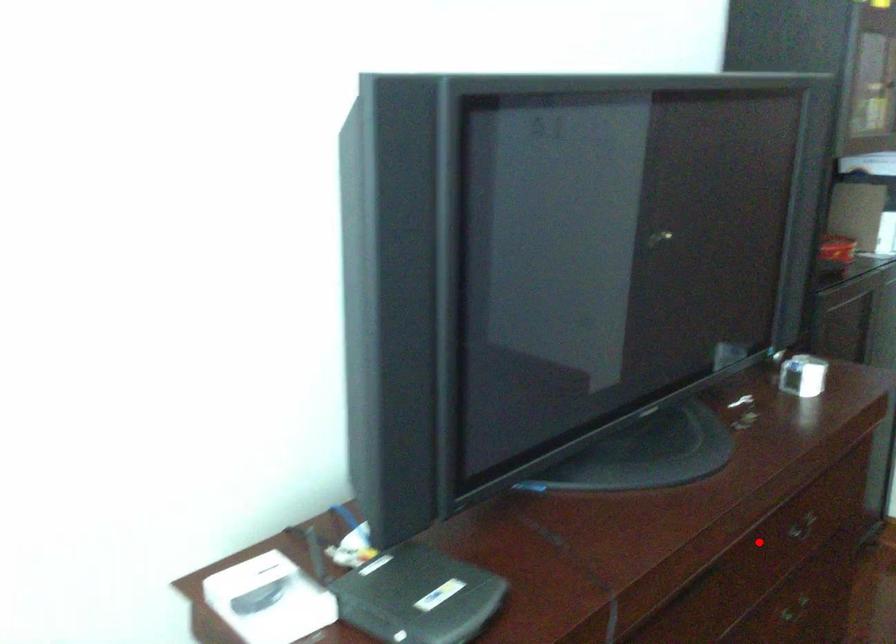
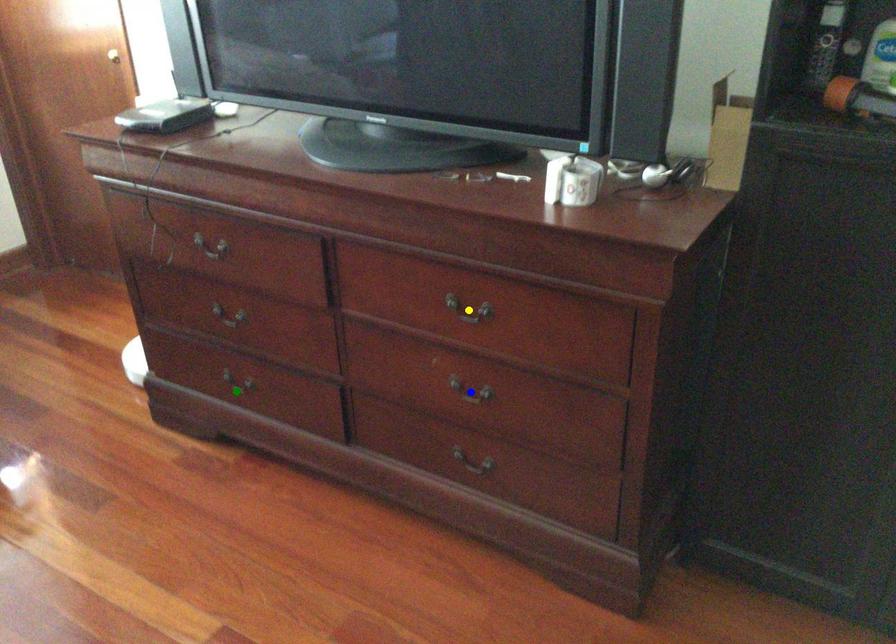
Question: I am providing you with two images of the same scene from different viewpoints. A red point is marked on the first image. You are given multiple points on the second image. Which spot in image 2 lines up with the point in image 1?

Choices:
 (A) green point
 (B) yellow point
 (C) blue point

Answer: (B)